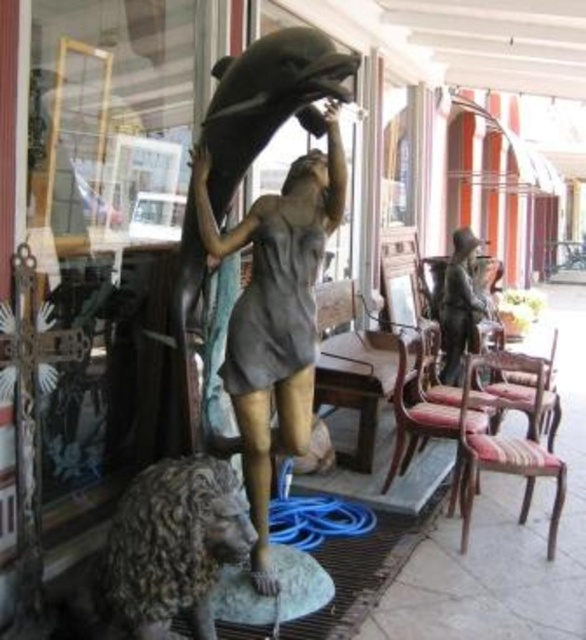
From the picture: Is striped fabric chair at right smaller than bronze statue at right?

No, striped fabric chair at right is not smaller than bronze statue at right.

Describe the element at coordinates (506, 444) in the screenshot. I see `striped fabric chair at right` at that location.

Where is `striped fabric chair at right`? This screenshot has height=640, width=586. striped fabric chair at right is located at coordinates (506, 444).

Who is shorter, bronze statue at center or striped fabric chair at right?

striped fabric chair at right

Which of these two, bronze statue at center or striped fabric chair at right, stands taller?

With more height is bronze statue at center.

Who is more forward, (260, 388) or (461, 552)?

Point (260, 388) is in front.

What are the coordinates of `bronze statue at center` in the screenshot? It's located at (275, 314).

Between bronze statue at center and wooden chair with upholstered seat at right, which one has more height?

Standing taller between the two is bronze statue at center.

Can you confirm if bronze statue at center is bigger than wooden chair with upholstered seat at right?

Incorrect, bronze statue at center is not larger than wooden chair with upholstered seat at right.

Which is in front, point (289, 410) or point (396, 408)?

Point (289, 410)

This screenshot has height=640, width=586. What are the coordinates of `bronze statue at center` in the screenshot? It's located at (275, 314).